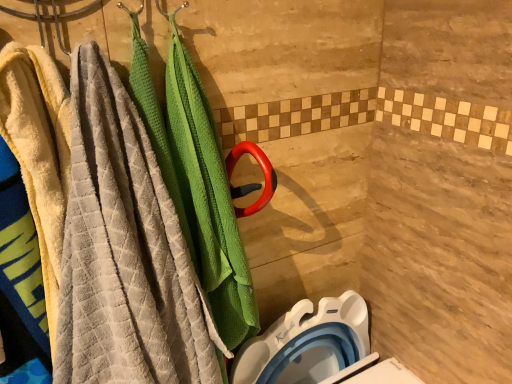
Question: From a real-world perspective, is soft yellow towel at left below textured gray towel at left?

Choices:
 (A) no
 (B) yes

Answer: (A)

Question: Considering the relative sizes of soft yellow towel at left and textured gray towel at left in the image provided, is soft yellow towel at left wider than textured gray towel at left?

Choices:
 (A) no
 (B) yes

Answer: (A)

Question: Is soft yellow towel at left beside textured gray towel at left?

Choices:
 (A) yes
 (B) no

Answer: (A)

Question: Is soft yellow towel at left positioned before textured gray towel at left?

Choices:
 (A) no
 (B) yes

Answer: (A)

Question: Considering the relative sizes of soft yellow towel at left and textured gray towel at left in the image provided, is soft yellow towel at left smaller than textured gray towel at left?

Choices:
 (A) yes
 (B) no

Answer: (A)

Question: Is soft yellow towel at left positioned beyond the bounds of textured gray towel at left?

Choices:
 (A) no
 (B) yes

Answer: (A)

Question: From a real-world perspective, is soft yellow towel at left under white plastic toilet bowl at lower right?

Choices:
 (A) no
 (B) yes

Answer: (A)

Question: Can you confirm if soft yellow towel at left is taller than white plastic toilet bowl at lower right?

Choices:
 (A) no
 (B) yes

Answer: (B)

Question: Could white plastic toilet bowl at lower right be considered to be inside soft yellow towel at left?

Choices:
 (A) no
 (B) yes

Answer: (A)

Question: Does soft yellow towel at left lie in front of white plastic toilet bowl at lower right?

Choices:
 (A) yes
 (B) no

Answer: (A)

Question: Is soft yellow towel at left oriented towards white plastic toilet bowl at lower right?

Choices:
 (A) no
 (B) yes

Answer: (A)

Question: Is white plastic toilet bowl at lower right at the back of soft yellow towel at left?

Choices:
 (A) no
 (B) yes

Answer: (A)

Question: Considering the relative sizes of white plastic toilet bowl at lower right and soft yellow towel at left in the image provided, is white plastic toilet bowl at lower right bigger than soft yellow towel at left?

Choices:
 (A) yes
 (B) no

Answer: (B)